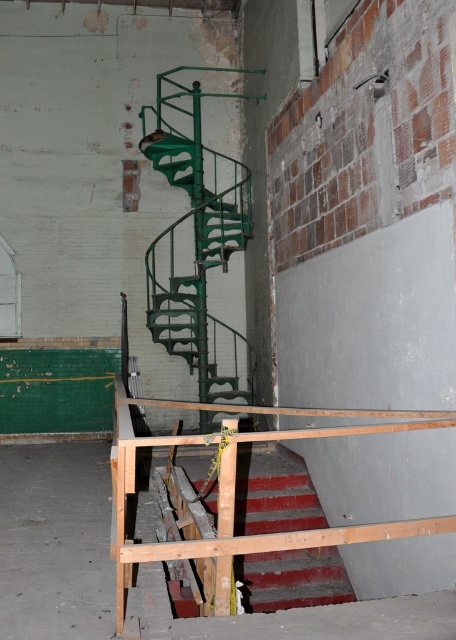
Question: Is green matte spiral staircase at center thinner than red textured stair at lower center?

Choices:
 (A) no
 (B) yes

Answer: (A)

Question: Is green matte spiral staircase at center below red textured stair at lower center?

Choices:
 (A) no
 (B) yes

Answer: (A)

Question: Which point is closer to the camera?

Choices:
 (A) (186, 141)
 (B) (342, 570)

Answer: (B)

Question: Which point appears farthest from the camera in this image?

Choices:
 (A) (255, 563)
 (B) (248, 99)

Answer: (B)

Question: Is green matte spiral staircase at center above red textured stair at lower center?

Choices:
 (A) yes
 (B) no

Answer: (A)